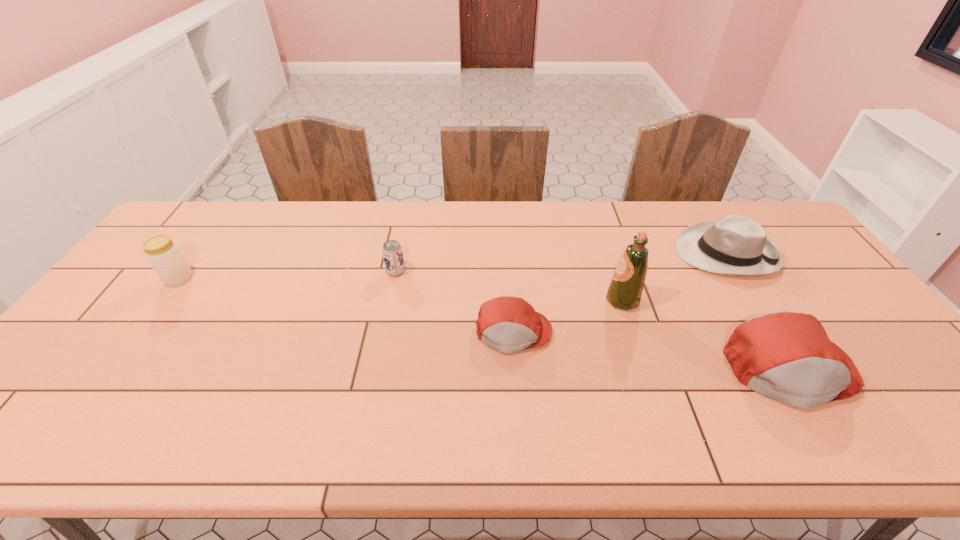
The height and width of the screenshot is (540, 960). What are the coordinates of `object that is the fifth closest one to the fifth object from right to left` in the screenshot? It's located at (787, 356).

Where is `the third closest object relative to the third object from left to right`? This screenshot has height=540, width=960. the third closest object relative to the third object from left to right is located at coordinates (787, 356).

You are a GUI agent. You are given a task and a screenshot of the screen. Output one action in this format:
    pyautogui.click(x=<x>, y=<y>)
    Task: Click on the vacant region that satisfies the following two spatial constraints: 1. on the front-facing side of the olive oil; 2. on the front-facing side of the fourth object from right to left
    This screenshot has height=540, width=960.
    Given the screenshot: What is the action you would take?
    pyautogui.click(x=633, y=332)

Image resolution: width=960 pixels, height=540 pixels. I want to click on vacant space that satisfies the following two spatial constraints: 1. on the front-facing side of the fedora; 2. on the front-facing side of the fourth object from right to left, so click(776, 332).

Find the location of a particular element. This screenshot has height=540, width=960. free point that satisfies the following two spatial constraints: 1. on the front-facing side of the fedora; 2. on the front-facing side of the taller cap is located at coordinates (800, 369).